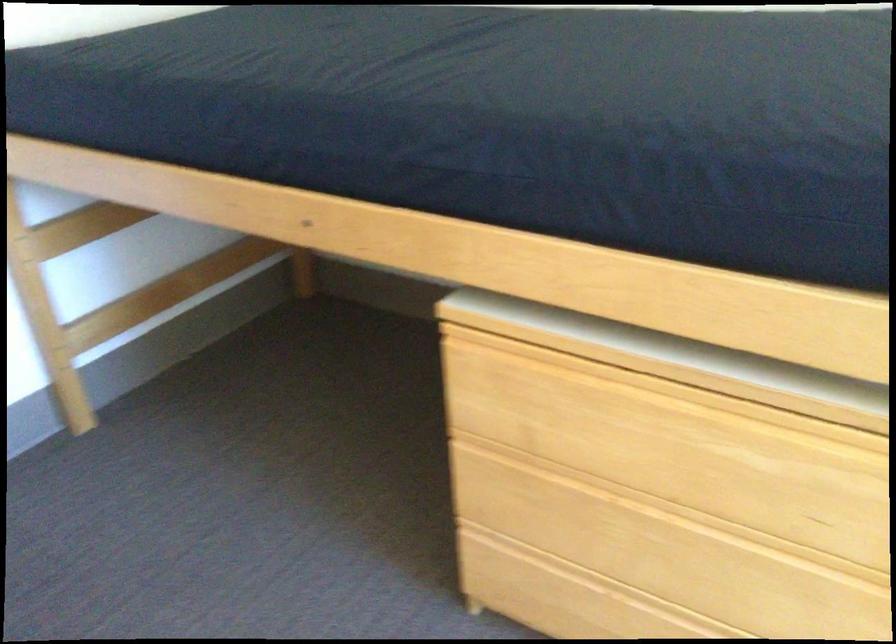
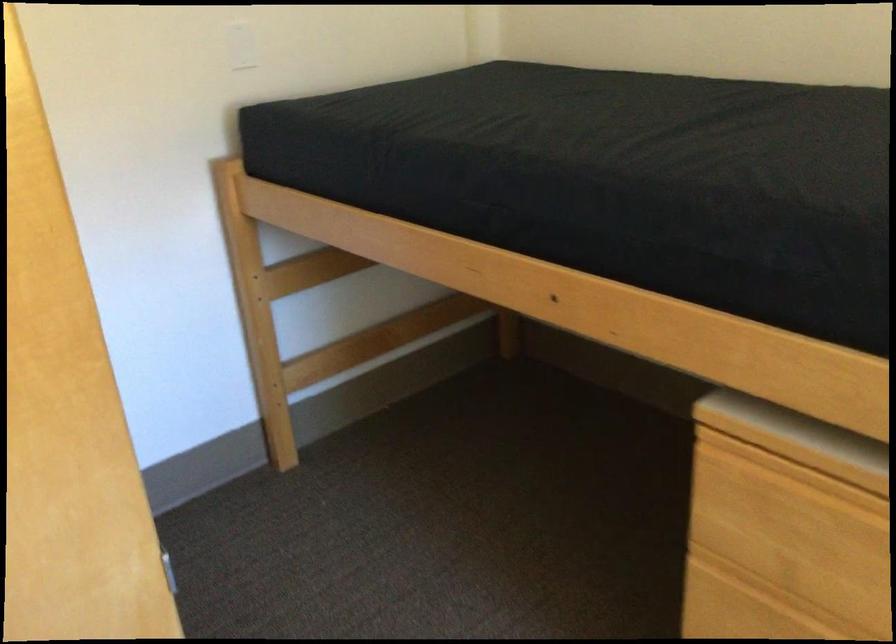
In the second image, find the point that corresponds to (80,230) in the first image.

(307, 270)